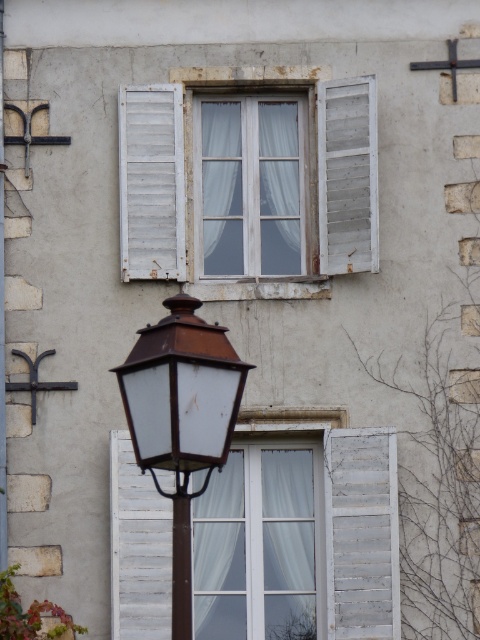
You are standing in front of the building and notice the white sheer curtain at center. Can you determine its exact position using the coordinate system provided?

The white sheer curtain at center is located at point [255,547] according to the coordinate system.

From the picture: You are standing in front of the building and want to place a small decoration between the two points, point (231, 512) and point (229, 371). Which point is closer to you where you should place the decoration?

Point (231, 512) is closer to you than point (229, 371), so you should place the decoration near point (231, 512).

You are a window cleaner who needs to clean both the white sheer curtain at center and the white wooden shutter at upper left. Which object requires a larger cleaning area?

The white sheer curtain at center requires a larger cleaning area because it is larger in size than the white wooden shutter at upper left.